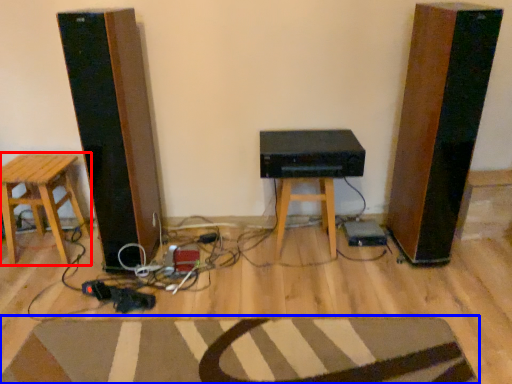
Question: Which of the following is the closest to the observer, stool (highlighted by a red box) or doormat (highlighted by a blue box)?

Choices:
 (A) stool
 (B) doormat

Answer: (B)